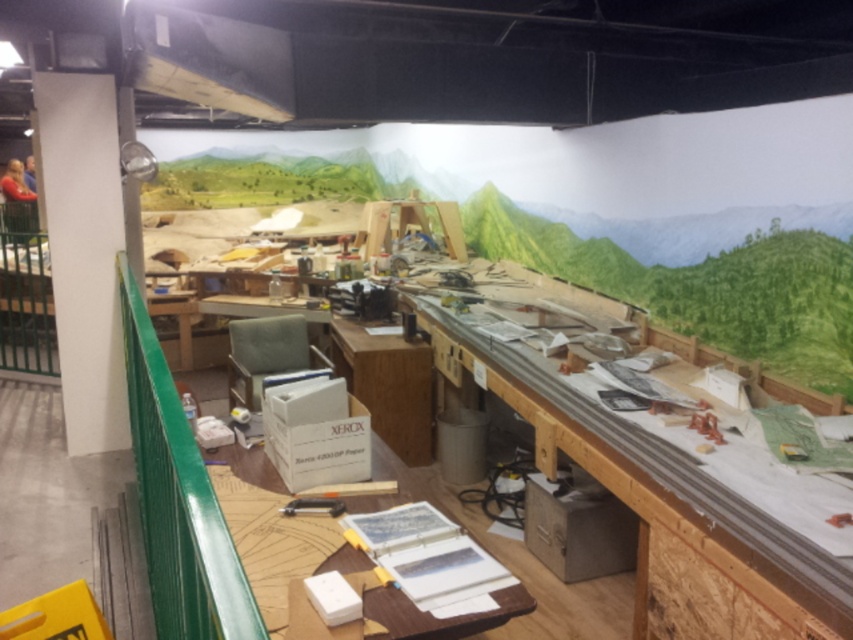
Is wooden table at center thinner than white smooth pillar at left?

In fact, wooden table at center might be wider than white smooth pillar at left.

You are a GUI agent. You are given a task and a screenshot of the screen. Output one action in this format:
    pyautogui.click(x=<x>, y=<y>)
    Task: Click on the wooden table at center
    The height and width of the screenshot is (640, 853).
    Given the screenshot: What is the action you would take?
    pyautogui.click(x=657, y=500)

Does point (558, 448) come closer to viewer compared to point (93, 86)?

Yes, it is.

In order to click on wooden table at center in this screenshot , I will do `click(657, 500)`.

Is wooden table at center wider than wooden at center?

Correct, the width of wooden table at center exceeds that of wooden at center.

Is wooden table at center behind wooden at center?

No.

Who is more distant from viewer, (746, 586) or (428, 625)?

Point (746, 586)

I want to click on wooden table at center, so click(x=657, y=500).

Which is more to the left, white smooth pillar at left or wooden at center?

white smooth pillar at left is more to the left.

Who is taller, white smooth pillar at left or wooden at center?

Standing taller between the two is white smooth pillar at left.

Between point (80, 188) and point (403, 493), which one is positioned in front?

Positioned in front is point (403, 493).

Where is `white smooth pillar at left`? This screenshot has width=853, height=640. white smooth pillar at left is located at coordinates (84, 252).